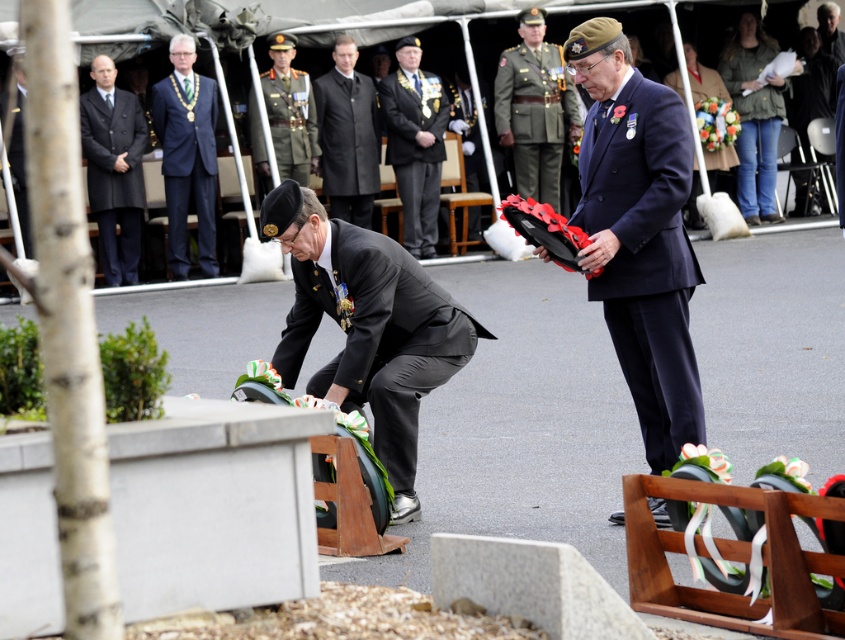
Question: Does blue fabric suit at upper center have a greater width compared to shiny green uniform at center?

Choices:
 (A) yes
 (B) no

Answer: (B)

Question: Which of the following is the farthest from the observer?

Choices:
 (A) black wool suit at left
 (B) dark blue suit at center
 (C) green military uniform at center

Answer: (C)

Question: Which of the following is the closest to the observer?

Choices:
 (A) black fabric suit at lower center
 (B) black matte suit at center
 (C) navy blue suit at center
 (D) blue fabric suit at upper center

Answer: (C)

Question: Is black wool suit at left closer to camera compared to shiny green uniform at center?

Choices:
 (A) no
 (B) yes

Answer: (B)

Question: Is green military uniform at center in front of black matte suit at center?

Choices:
 (A) no
 (B) yes

Answer: (A)

Question: Among these objects, which one is nearest to the camera?

Choices:
 (A) green military uniform at center
 (B) dark blue suit at center

Answer: (B)